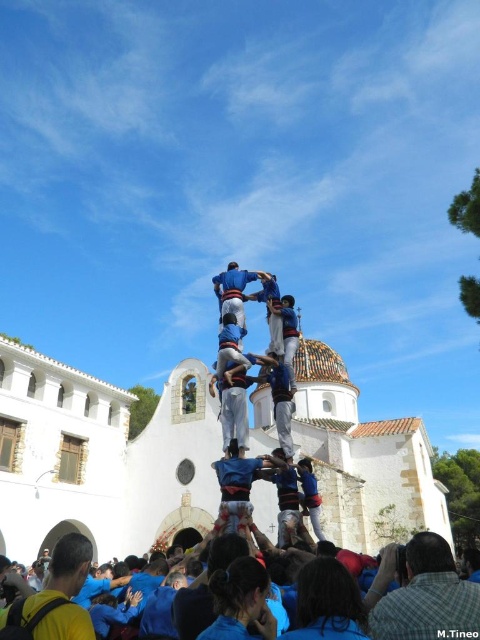
You are a photographer at the event and want to capture the human tower. You notice the blue shirt at lower center and the blue fabric crowd at lower center. Which of these two has a greater height in the image?

The blue fabric crowd at lower center has a greater height compared to the blue shirt at lower center according to the description.

You are a photographer at the event and want to capture the castells human tower. You notice the blue shirt at lower center and the blue fabric crowd at lower center. Which of these two has a smaller size in the image?

The blue shirt at lower center has a smaller size compared to the blue fabric crowd at lower center.

You are a photographer at the event and want to capture both the blue fabric crowd at lower center and the yellow shirt at lower left in a single frame. Which object should you focus on first to ensure both are in the frame?

The blue fabric crowd at lower center has a greater width than the yellow shirt at lower left, so focusing on the blue fabric crowd at lower center first will help ensure both are captured in the frame.